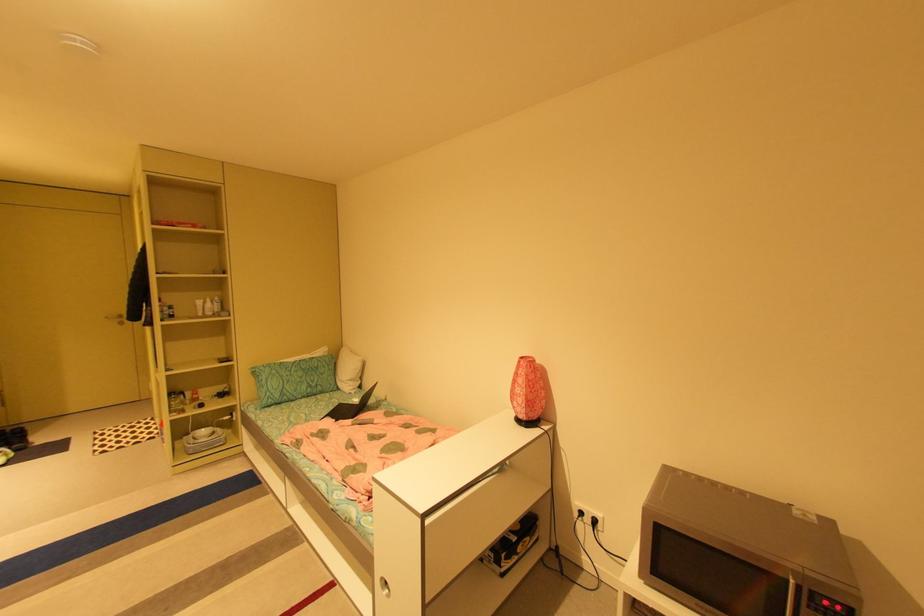
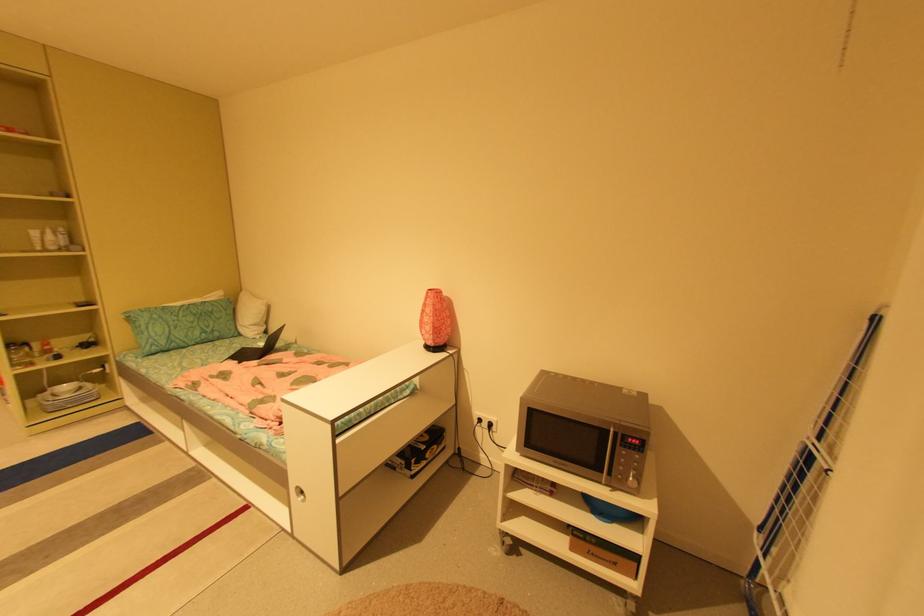
Question: The camera is either moving clockwise (left) or counter-clockwise (right) around the object. The first image is from the beginning of the video and the second image is from the end. Is the camera moving left or right when shooting the video?

Choices:
 (A) Left
 (B) Right

Answer: (A)